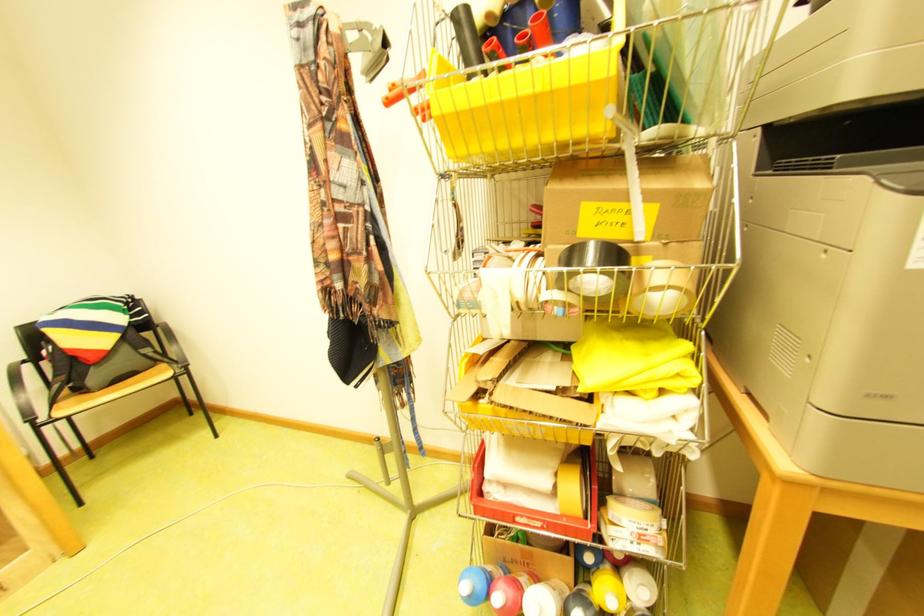
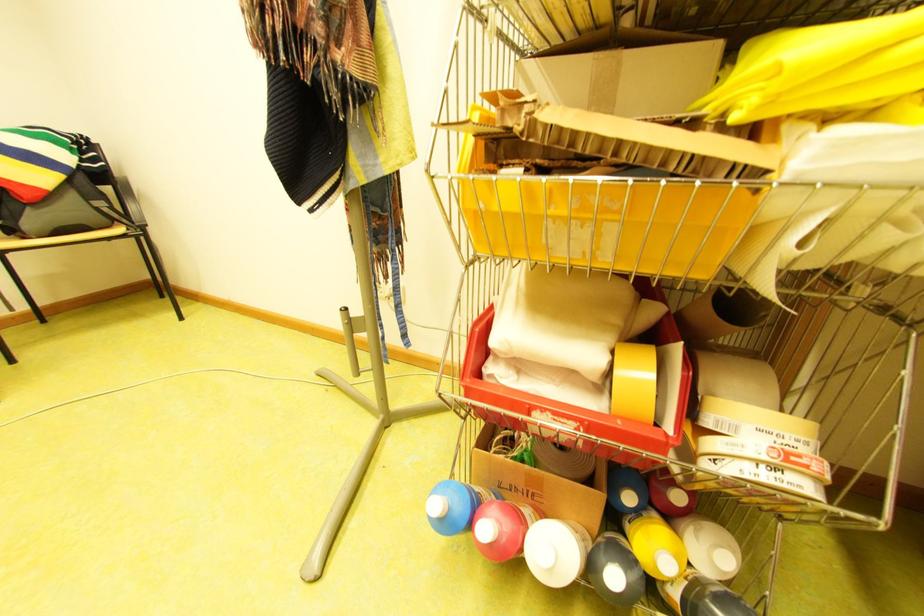
In the second image, find the point that corresponds to the point at 610,569 in the first image.

(649, 513)